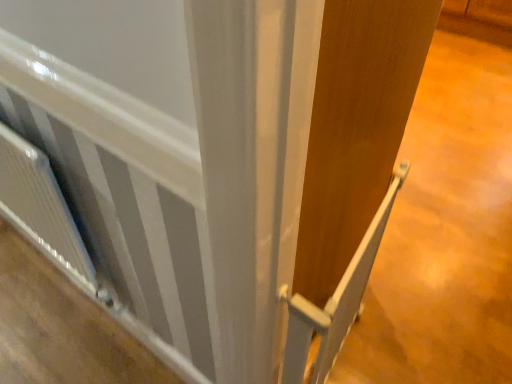
Locate an element on the screen. The height and width of the screenshot is (384, 512). white glossy radiator at lower left is located at coordinates (62, 327).

The width and height of the screenshot is (512, 384). What do you see at coordinates (62, 327) in the screenshot? I see `white glossy radiator at lower left` at bounding box center [62, 327].

Where is `white textured radiator at lower left`? The image size is (512, 384). white textured radiator at lower left is located at coordinates (40, 201).

Identify the location of white glossy radiator at lower left. This screenshot has height=384, width=512. (62, 327).

Does white plastic rail at center appear on the right side of white glossy radiator at lower left?

Indeed, white plastic rail at center is positioned on the right side of white glossy radiator at lower left.

Looking at their sizes, would you say white plastic rail at center is wider or thinner than white glossy radiator at lower left?

Clearly, white plastic rail at center has less width compared to white glossy radiator at lower left.

Which is farther from the camera, (332, 361) or (73, 344)?

Positioned behind is point (73, 344).

Would you say white glossy radiator at lower left is to the left or to the right of white textured radiator at lower left in the picture?

In the image, white glossy radiator at lower left appears on the right side of white textured radiator at lower left.

Between white glossy radiator at lower left and white textured radiator at lower left, which one has larger size?

white textured radiator at lower left is bigger.

Is point (51, 266) farther from viewer compared to point (57, 218)?

Yes.

Is white glossy radiator at lower left thinner than white textured radiator at lower left?

Incorrect, the width of white glossy radiator at lower left is not less than that of white textured radiator at lower left.

From the picture: Is white plastic rail at center facing away from white textured radiator at lower left?

Yes, white plastic rail at center is facing away from white textured radiator at lower left.

Which is more to the right, white plastic rail at center or white textured radiator at lower left?

From the viewer's perspective, white plastic rail at center appears more on the right side.

Is point (346, 275) closer to camera compared to point (1, 173)?

Yes, point (346, 275) is closer to viewer.

Between white plastic rail at center and white textured radiator at lower left, which one has smaller size?

white plastic rail at center.

Would you say white textured radiator at lower left is outside white plastic rail at center?

Absolutely, white textured radiator at lower left is external to white plastic rail at center.

Considering the points (26, 149) and (333, 301), which point is behind, point (26, 149) or point (333, 301)?

The point (26, 149) is more distant.

Could you tell me if white textured radiator at lower left is facing white plastic rail at center?

No, white textured radiator at lower left is not oriented towards white plastic rail at center.

From a real-world perspective, which object rests below the other?

white plastic rail at center, from a real-world perspective.

Image resolution: width=512 pixels, height=384 pixels. In order to click on plywood below the white plastic rail at center (from a real-world perspective) in this screenshot , I will do `click(62, 327)`.

Between white glossy radiator at lower left and white plastic rail at center, which one has larger size?

Bigger between the two is white plastic rail at center.

Is white glossy radiator at lower left not close to white plastic rail at center?

white glossy radiator at lower left is near white plastic rail at center, not far away.

Which object is wider, white glossy radiator at lower left or white plastic rail at center?

With larger width is white glossy radiator at lower left.

In the scene shown: Between white textured radiator at lower left and white glossy radiator at lower left, which one has smaller size?

Smaller between the two is white glossy radiator at lower left.

Does point (45, 229) lie behind point (110, 315)?

No.

Does white textured radiator at lower left have a lesser width compared to white glossy radiator at lower left?

Indeed, white textured radiator at lower left has a lesser width compared to white glossy radiator at lower left.

In order to click on rail above the white glossy radiator at lower left (from the image's perspective) in this screenshot , I will do `click(335, 301)`.

The width and height of the screenshot is (512, 384). Find the location of `radiator on the left of white glossy radiator at lower left`. radiator on the left of white glossy radiator at lower left is located at coordinates (40, 201).

From the image, which object appears to be nearer to white textured radiator at lower left, white glossy radiator at lower left or white plastic rail at center?

Among the two, white glossy radiator at lower left is located nearer to white textured radiator at lower left.

Looking at the image, which one is located closer to white plastic rail at center, white glossy radiator at lower left or white textured radiator at lower left?

Among the two, white textured radiator at lower left is located nearer to white plastic rail at center.

Which object lies further to the anchor point white glossy radiator at lower left, white textured radiator at lower left or white plastic rail at center?

The object further to white glossy radiator at lower left is white plastic rail at center.

Which object lies nearer to the anchor point white plastic rail at center, white textured radiator at lower left or white glossy radiator at lower left?

white textured radiator at lower left is closer to white plastic rail at center.

Estimate the real-world distances between objects in this image. Which object is closer to white textured radiator at lower left, white plastic rail at center or white glossy radiator at lower left?

white glossy radiator at lower left is closer to white textured radiator at lower left.

When comparing their distances from white glossy radiator at lower left, does white plastic rail at center or white textured radiator at lower left seem further?

white plastic rail at center is further to white glossy radiator at lower left.

The width and height of the screenshot is (512, 384). I want to click on plywood between white textured radiator at lower left and white plastic rail at center in the horizontal direction, so click(62, 327).